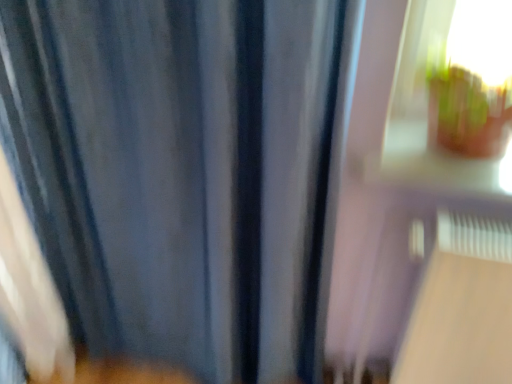
Describe the element at coordinates (184, 172) in the screenshot. This screenshot has height=384, width=512. I see `blue fabric curtain at center` at that location.

The height and width of the screenshot is (384, 512). I want to click on blue fabric curtain at center, so click(x=184, y=172).

What is the approximate height of blue fabric curtain at center?

It is 1.22 meters.

The image size is (512, 384). What do you see at coordinates (452, 97) in the screenshot? I see `transparent glass window at upper right` at bounding box center [452, 97].

You are a GUI agent. You are given a task and a screenshot of the screen. Output one action in this format:
    pyautogui.click(x=<x>, y=<y>)
    Task: Click on the transparent glass window at upper right
    This screenshot has width=512, height=384.
    Given the screenshot: What is the action you would take?
    pyautogui.click(x=452, y=97)

Locate an element on the screen. The image size is (512, 384). blue fabric curtain at center is located at coordinates (184, 172).

Which is more to the right, blue fabric curtain at center or transparent glass window at upper right?

transparent glass window at upper right.

Based on the photo, is blue fabric curtain at center closer to camera compared to transparent glass window at upper right?

Yes.

Is point (314, 34) in front of point (479, 176)?

Yes, point (314, 34) is closer to viewer.

From the image's perspective, which is below, blue fabric curtain at center or transparent glass window at upper right?

From the image's view, blue fabric curtain at center is below.

From a real-world perspective, is blue fabric curtain at center located beneath transparent glass window at upper right?

Yes.

Which of these two, blue fabric curtain at center or transparent glass window at upper right, is wider?

With larger width is transparent glass window at upper right.

Which of these two, blue fabric curtain at center or transparent glass window at upper right, stands taller?

With more height is blue fabric curtain at center.

Does blue fabric curtain at center have a smaller size compared to transparent glass window at upper right?

Incorrect, blue fabric curtain at center is not smaller in size than transparent glass window at upper right.

Is blue fabric curtain at center outside of transparent glass window at upper right?

blue fabric curtain at center is positioned outside transparent glass window at upper right.

Is blue fabric curtain at center far from transparent glass window at upper right?

No, blue fabric curtain at center is not far from transparent glass window at upper right.

Is blue fabric curtain at center oriented away from transparent glass window at upper right?

No, transparent glass window at upper right is not at the back of blue fabric curtain at center.

Measure the distance from blue fabric curtain at center to transparent glass window at upper right.

They are 18.31 inches apart.

Locate an element on the screen. curtain located underneath the transparent glass window at upper right (from a real-world perspective) is located at coordinates (184, 172).

Considering the relative positions of transparent glass window at upper right and blue fabric curtain at center in the image provided, is transparent glass window at upper right to the right of blue fabric curtain at center from the viewer's perspective?

Yes.

Does transparent glass window at upper right come behind blue fabric curtain at center?

Yes.

Is point (490, 173) positioned in front of point (252, 55)?

That is False.

From the image's perspective, is transparent glass window at upper right above blue fabric curtain at center?

Correct, transparent glass window at upper right appears higher than blue fabric curtain at center in the image.

From a real-world perspective, is transparent glass window at upper right located beneath blue fabric curtain at center?

No, from a real-world perspective, transparent glass window at upper right is not below blue fabric curtain at center.

Is transparent glass window at upper right thinner than blue fabric curtain at center?

No, transparent glass window at upper right is not thinner than blue fabric curtain at center.

Who is shorter, transparent glass window at upper right or blue fabric curtain at center?

With less height is transparent glass window at upper right.

Between transparent glass window at upper right and blue fabric curtain at center, which one has larger size?

blue fabric curtain at center is bigger.

Is transparent glass window at upper right inside or outside of blue fabric curtain at center?

transparent glass window at upper right is outside blue fabric curtain at center.

Is transparent glass window at upper right positioned far away from blue fabric curtain at center?

transparent glass window at upper right is near blue fabric curtain at center, not far away.

Is transparent glass window at upper right positioned with its back to blue fabric curtain at center?

No, transparent glass window at upper right is not facing away from blue fabric curtain at center.

What's the angular difference between transparent glass window at upper right and blue fabric curtain at center's facing directions?

0.00198 degrees.

Find the location of a particular element. train window above the blue fabric curtain at center (from the image's perspective) is located at coordinates (452, 97).

Identify the location of curtain located below the transparent glass window at upper right (from the image's perspective). The width and height of the screenshot is (512, 384). (184, 172).

What are the coordinates of `curtain on the left of transparent glass window at upper right` in the screenshot? It's located at 184,172.